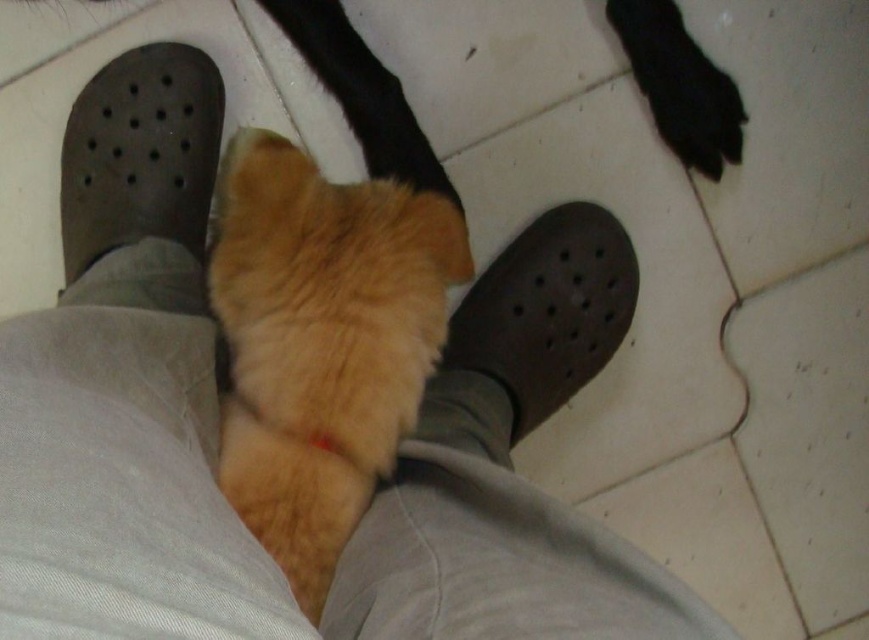
You are trying to locate the fuzzy orange cat at center and the brown rubber shoe at center in the image. According to the scene, which of these two objects is positioned to the left?

The fuzzy orange cat at center is positioned to the left of the brown rubber shoe at center.

You are a photographer trying to capture the exact position of the dark grey rubber shoe at left in the image. According to the coordinates provided, where should you focus your camera lens to ensure the shoe is centered in the frame?

To center the dark grey rubber shoe at left in the frame, focus the camera lens at the coordinates point (140, 154) where the shoe is located.